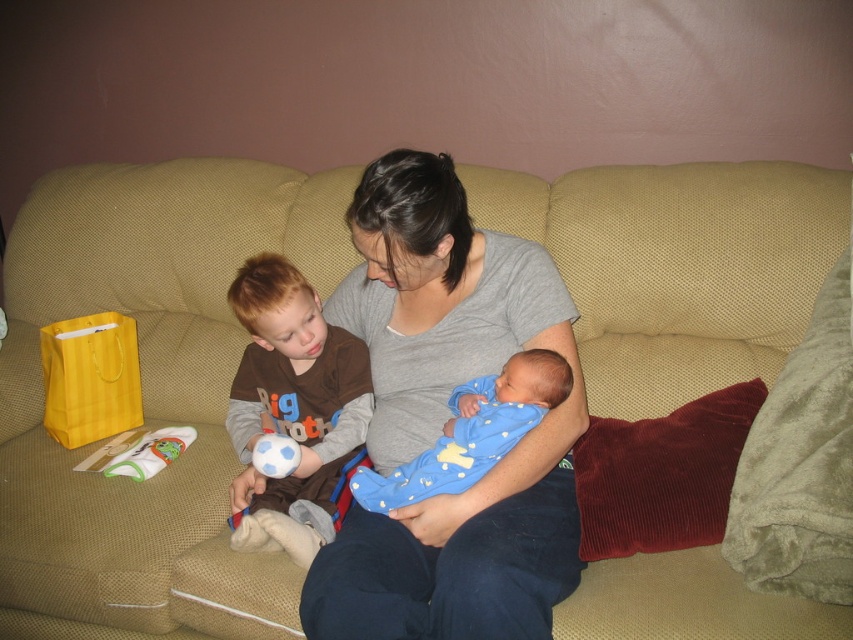
Question: Which of the following is the closest to the observer?

Choices:
 (A) (537, 360)
 (B) (442, 518)
 (C) (302, 444)

Answer: (B)

Question: Which point is closer to the camera?

Choices:
 (A) brown cotton shirt at left
 (B) blue soft fabric baby at center
 (C) blue soft fabric at center
 (D) gray cotton shirt at center

Answer: (C)

Question: Can you confirm if blue soft fabric at center is smaller than brown cotton shirt at left?

Choices:
 (A) yes
 (B) no

Answer: (A)

Question: Which point is farther to the camera?

Choices:
 (A) (502, 237)
 (B) (380, 621)

Answer: (A)

Question: Is blue soft fabric at center positioned in front of blue soft fabric baby at center?

Choices:
 (A) no
 (B) yes

Answer: (B)

Question: Can you confirm if blue soft fabric at center is smaller than brown cotton shirt at left?

Choices:
 (A) yes
 (B) no

Answer: (A)